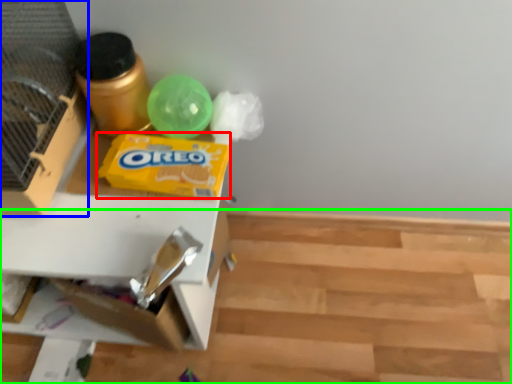
Question: Which object is the closest to the waste (highlighted by a red box)? Choose among these: bird cage (highlighted by a blue box) or wood (highlighted by a green box).

Choices:
 (A) bird cage
 (B) wood

Answer: (A)